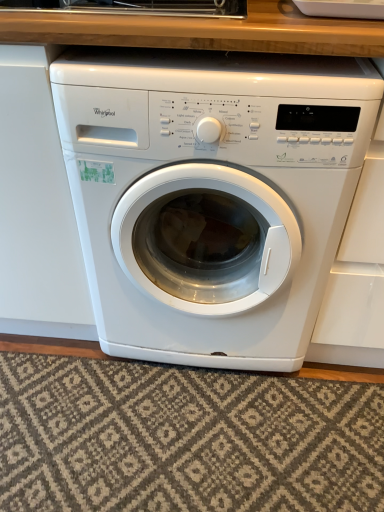
Question: Is textured beige rug at lower center at the right side of white glossy washing machine at center?

Choices:
 (A) no
 (B) yes

Answer: (A)

Question: Is textured beige rug at lower center not within white glossy washing machine at center?

Choices:
 (A) no
 (B) yes

Answer: (B)

Question: From the image's perspective, does textured beige rug at lower center appear higher than white glossy washing machine at center?

Choices:
 (A) no
 (B) yes

Answer: (A)

Question: From the image's perspective, would you say textured beige rug at lower center is shown under white glossy washing machine at center?

Choices:
 (A) yes
 (B) no

Answer: (A)

Question: Is the position of textured beige rug at lower center less distant than that of white glossy washing machine at center?

Choices:
 (A) yes
 (B) no

Answer: (B)

Question: Is textured beige rug at lower center placed right next to white glossy washing machine at center?

Choices:
 (A) no
 (B) yes

Answer: (A)

Question: From a real-world perspective, is white glossy washing machine at center on textured beige rug at lower center?

Choices:
 (A) yes
 (B) no

Answer: (A)

Question: Is textured beige rug at lower center completely or partially inside white glossy washing machine at center?

Choices:
 (A) no
 (B) yes

Answer: (A)

Question: Can you confirm if white glossy washing machine at center is positioned to the left of textured beige rug at lower center?

Choices:
 (A) no
 (B) yes

Answer: (A)

Question: From a real-world perspective, does white glossy washing machine at center sit lower than textured beige rug at lower center?

Choices:
 (A) yes
 (B) no

Answer: (B)

Question: Would you say white glossy washing machine at center is outside textured beige rug at lower center?

Choices:
 (A) no
 (B) yes

Answer: (B)

Question: Considering the relative sizes of white glossy washing machine at center and textured beige rug at lower center in the image provided, is white glossy washing machine at center taller than textured beige rug at lower center?

Choices:
 (A) yes
 (B) no

Answer: (A)

Question: From a real-world perspective, relative to textured beige rug at lower center, is white glossy washing machine at center vertically above or below?

Choices:
 (A) below
 (B) above

Answer: (B)